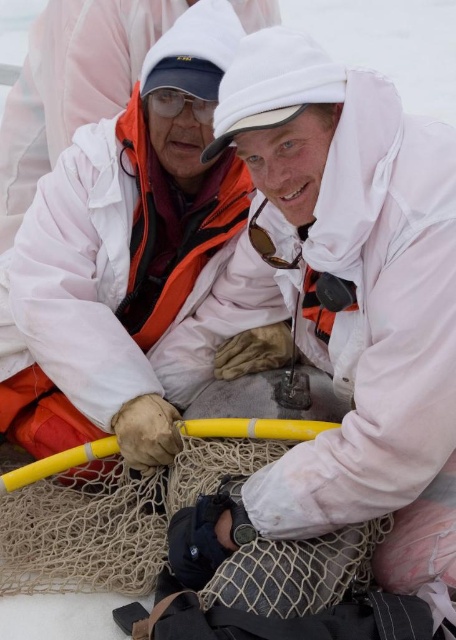
Question: Where is matte black goggles at upper center located in relation to sunglasses at center in the image?

Choices:
 (A) below
 (B) above

Answer: (B)

Question: Does white matte jacket at center have a smaller size compared to matte white jacket at upper center?

Choices:
 (A) yes
 (B) no

Answer: (A)

Question: Which object is closer to the camera taking this photo?

Choices:
 (A) white matte jacket at center
 (B) matte black goggles at upper center

Answer: (A)

Question: Is white matte jacket at upper left to the right of matte black goggles at upper center from the viewer's perspective?

Choices:
 (A) no
 (B) yes

Answer: (A)

Question: Which point is farther from the camera taking this photo?

Choices:
 (A) (203, 124)
 (B) (56, 422)
 (C) (269, 248)
 (D) (46, 140)

Answer: (D)

Question: Which object is positioned farthest from the matte white jacket at upper center?

Choices:
 (A) sunglasses at center
 (B) matte black goggles at upper center
 (C) white matte jacket at upper left
 (D) white matte jacket at center

Answer: (D)